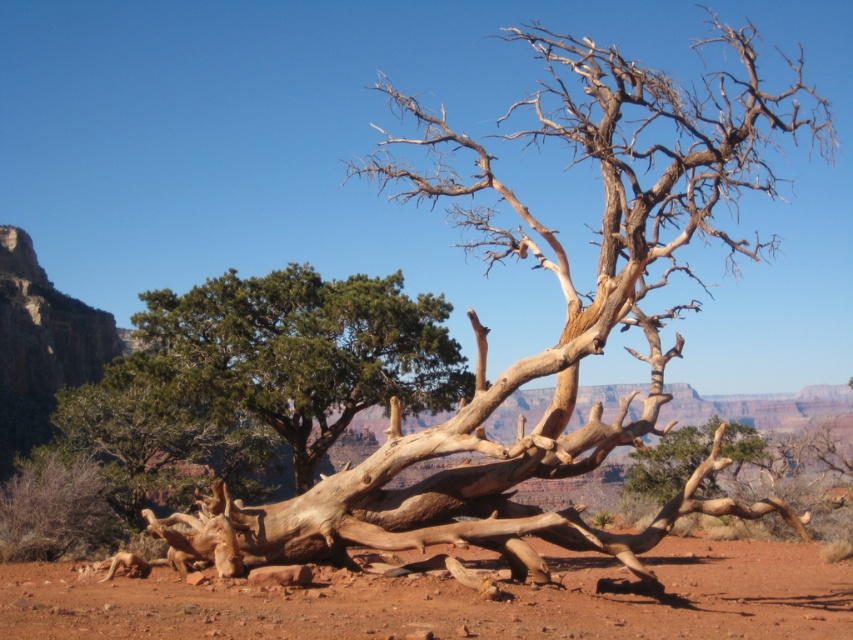
Does green textured tree at center have a smaller size compared to light brown wood tree at center?

Yes.

Which is behind, point (325, 314) or point (715, 488)?

The point (715, 488) is more distant.

At what (x,y) coordinates should I click in order to perform the action: click on green textured tree at center. Please return your answer as a coordinate pair (x, y). This screenshot has width=853, height=640. Looking at the image, I should click on (306, 349).